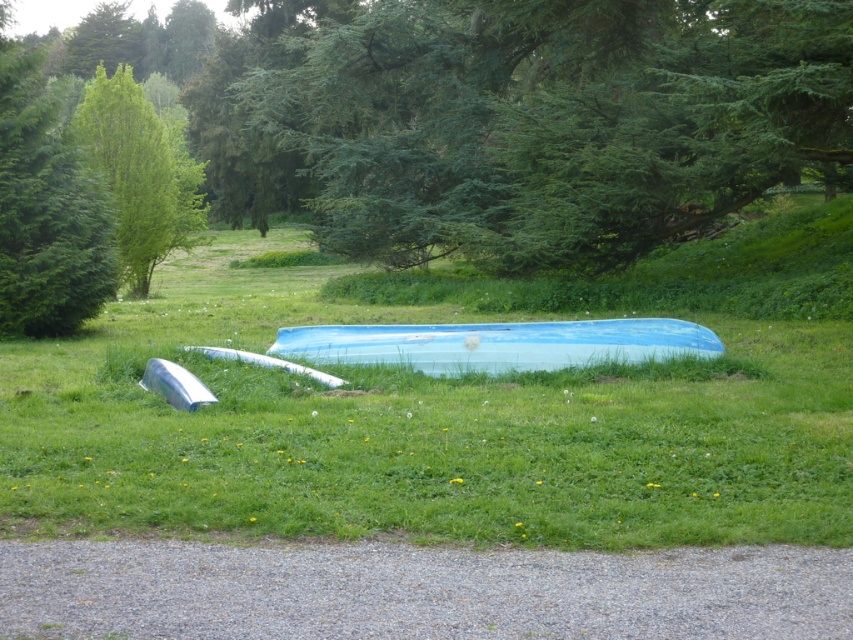
You are planning to set up a picnic blanket in the green grassy field at center. However, you want to ensure it stays dry in case of rain. Considering the position of the green leafy tree at upper left, where should you place the blanket to avoid getting wet?

The green grassy field at center is positioned under green leafy tree at upper left, so placing the picnic blanket under the tree would provide shelter from rain.

You are standing at the gravel path leading towards the grassy area and want to place a 1.5 meter long ladder between the green textured tree at upper center and the damaged boat. Is there enough space between them to place the ladder horizontally?

The distance between the green textured tree at upper center and the damaged boat is 16.60 meters, which is more than enough space to place a 1.5 meter long ladder horizontally between them.